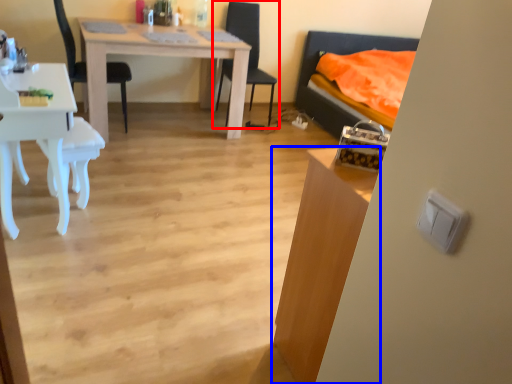
Question: Which object is further to the camera taking this photo, chair (highlighted by a red box) or table (highlighted by a blue box)?

Choices:
 (A) chair
 (B) table

Answer: (A)